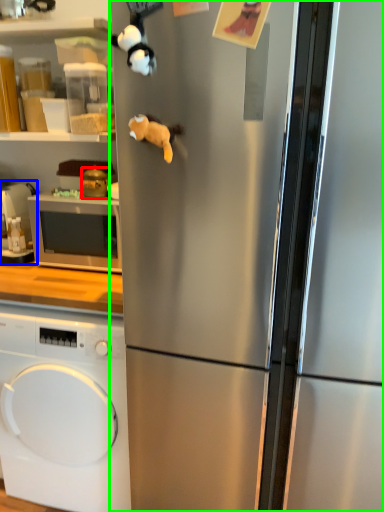
Question: Which is farther away from appliance (highlighted by a red box)? appliance (highlighted by a blue box) or refrigerator (highlighted by a green box)?

Choices:
 (A) appliance
 (B) refrigerator

Answer: (B)